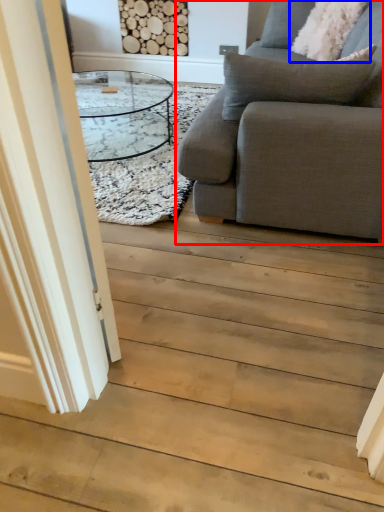
Question: Which point is further to the camera, studio couch (highlighted by a red box) or pillow (highlighted by a blue box)?

Choices:
 (A) studio couch
 (B) pillow

Answer: (B)